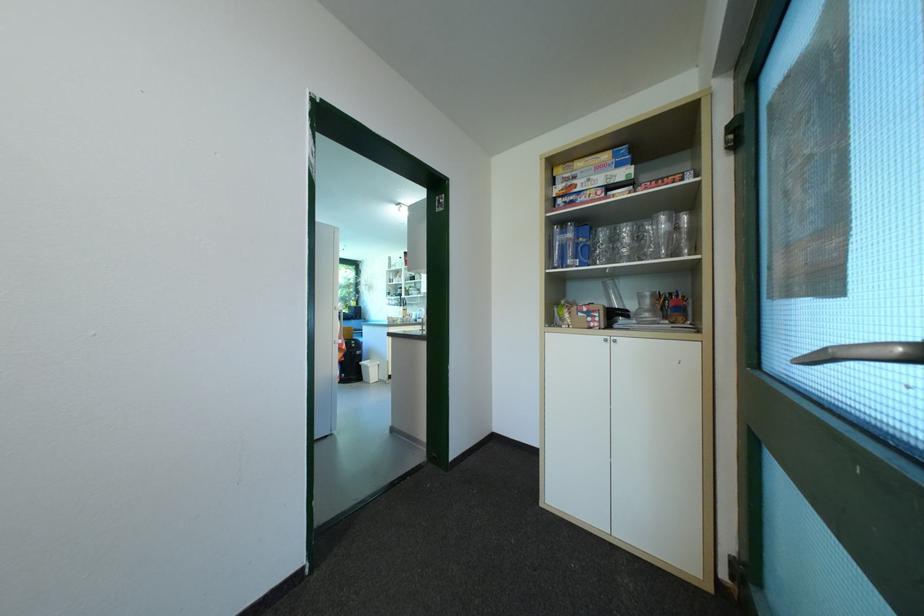
Locate an element on the screen. The height and width of the screenshot is (616, 924). glass carafe is located at coordinates (663, 233).